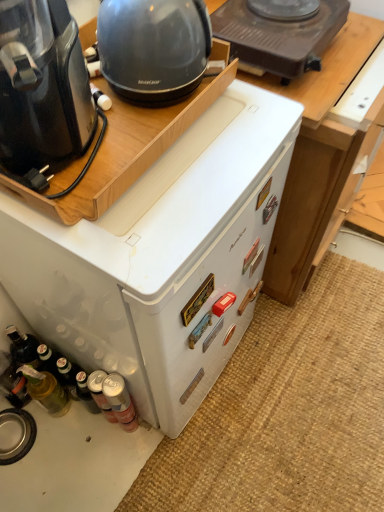
Identify the location of vacant space in front of matte black kettle at upper left. The height and width of the screenshot is (512, 384). (206, 162).